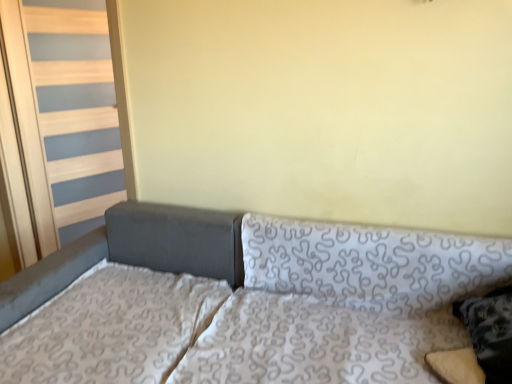
Question: Considering the positions of point (65, 380) and point (400, 238), is point (65, 380) closer or farther from the camera than point (400, 238)?

Choices:
 (A) closer
 (B) farther

Answer: (A)

Question: Do you think patterned fabric mattress at lower left is within patterned fabric studio couch at center, or outside of it?

Choices:
 (A) outside
 (B) inside

Answer: (B)

Question: Which object is positioned farthest from the patterned fabric studio couch at center?

Choices:
 (A) patterned fabric pillow at right
 (B) patterned fabric mattress at lower left

Answer: (A)

Question: Based on their relative distances, which object is nearer to the patterned fabric mattress at lower left?

Choices:
 (A) patterned fabric studio couch at center
 (B) patterned fabric pillow at right

Answer: (A)